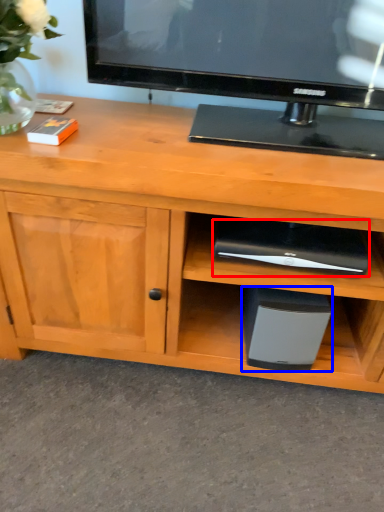
Question: Which of the following is the farthest to the observer, appliance (highlighted by a red box) or appliance (highlighted by a blue box)?

Choices:
 (A) appliance
 (B) appliance

Answer: (B)